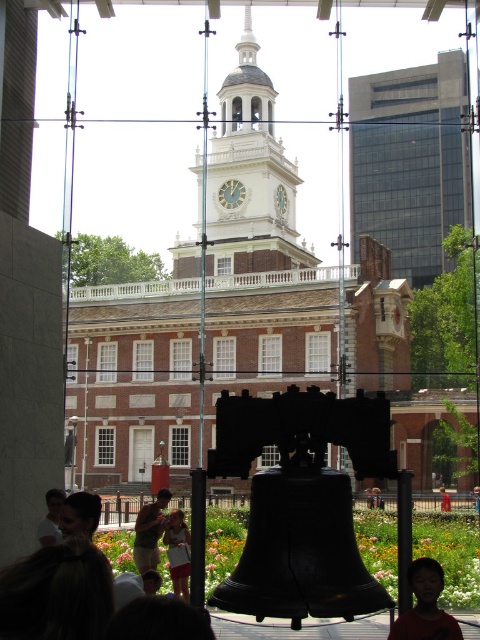
Question: Is tan cotton shirt at center wider than white cotton shirt at lower left?

Choices:
 (A) yes
 (B) no

Answer: (A)

Question: Which object is the closest to the brown fabric shirt at lower right?

Choices:
 (A) gold metallic clock at center
 (B) tan cotton shirt at center
 (C) light brown wooden chair at lower center

Answer: (C)

Question: Is dark brown hair at lower left further to the viewer compared to brown fabric shirt at lower right?

Choices:
 (A) no
 (B) yes

Answer: (A)

Question: Which object appears farthest from the camera in this image?

Choices:
 (A) dark brown hair at lower left
 (B) light brown hair at lower center

Answer: (B)

Question: Which point is farther to the camera?

Choices:
 (A) white cotton shirt at lower left
 (B) white painted wood clock at center

Answer: (B)

Question: Observing the image, what is the correct spatial positioning of brown wood pillar at lower center in reference to brown fabric shirt at lower right?

Choices:
 (A) left
 (B) right

Answer: (A)